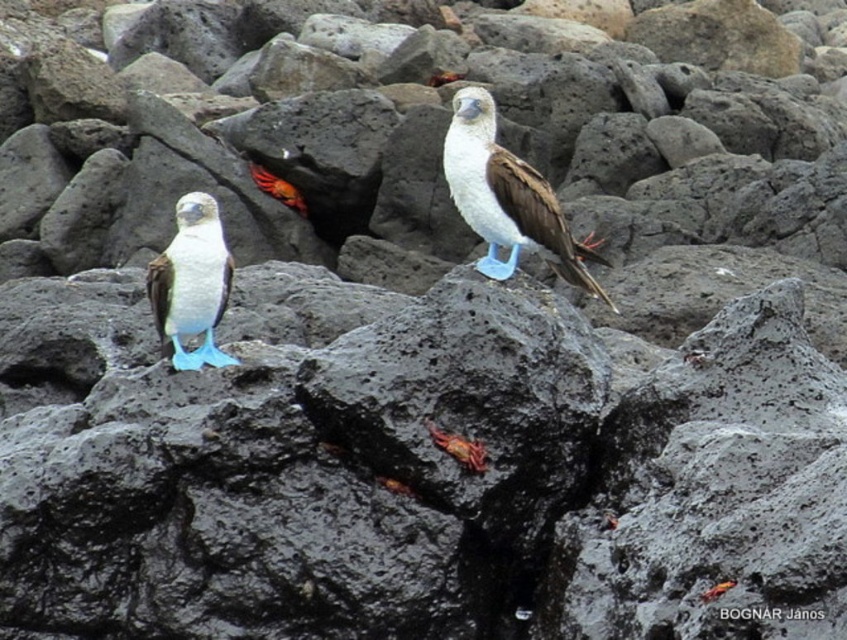
You are a photographer aiming to capture the matte white bird at center and the smooth orange crab at center in a single shot. Given their relative sizes, which subject should you focus on first to ensure both are in frame?

The matte white bird at center is taller than the smooth orange crab at center. To ensure both are in frame, focus on the matte white bird at center first as it requires more vertical space due to its greater height.

You are a marine biologist observing the scene. There is a smooth orange crab at center. You need to place a 10 feet long measuring tape between the two birds. Can you fit the measuring tape between them?

The two birds are 12.57 feet apart, so yes, the 10 feet long measuring tape can fit between them since the distance is greater than the tape length.

You are a photographer trying to capture both the smooth orange crab at center and the shiny orange crab at center in a single shot. Which crab should you adjust your camera focus to first if you want to ensure the one closer to you is in focus?

The smooth orange crab at center is positioned on the right side of shiny orange crab at center. Since they are both at the center, their distance from you is similar, so focus on either one first.